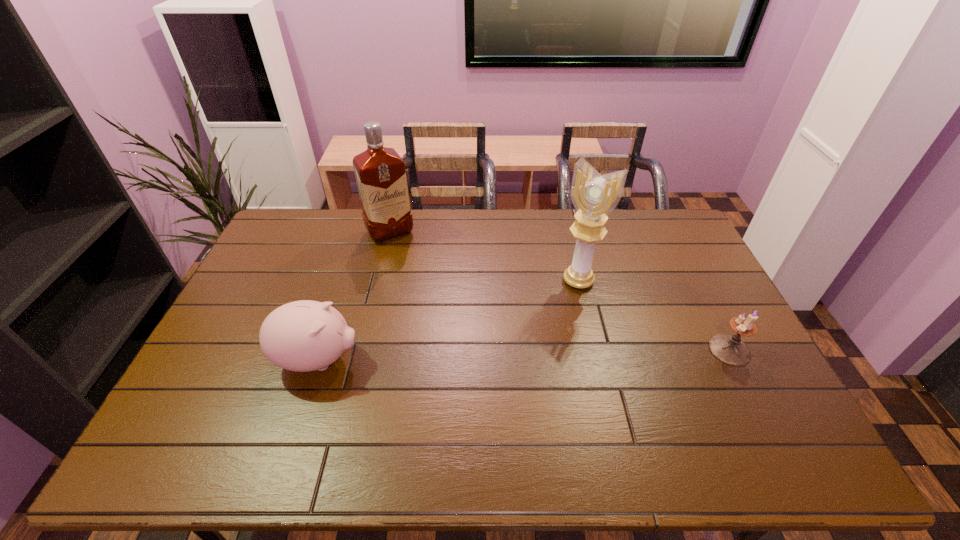
This screenshot has height=540, width=960. Identify the location of vacant spot on the desktop that is between the piggy bank and the candle holder and is positioned on the front label of the farthest object. (465, 356).

Locate an element on the screen. The width and height of the screenshot is (960, 540). vacant space on the desktop that is between the piggy bank and the rightmost object and is positioned on the front-facing side of the award is located at coordinates (530, 354).